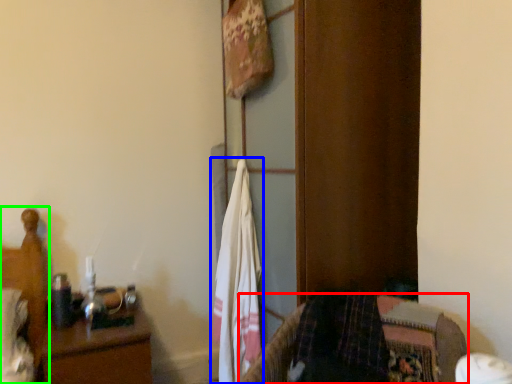
Question: Which object is the farthest from furniture (highlighted by a red box)? Choose among these: laundry (highlighted by a blue box) or bed (highlighted by a green box).

Choices:
 (A) laundry
 (B) bed

Answer: (B)